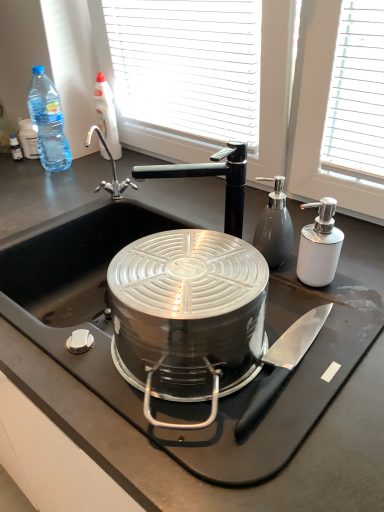
Question: From the image's perspective, is satin silver pump dispenser at right, positioned as the 1th bottle in right-to-left order, positioned above or below white glossy soap dispenser at right?

Choices:
 (A) above
 (B) below

Answer: (A)

Question: Is point (274, 259) positioned closer to the camera than point (324, 261)?

Choices:
 (A) farther
 (B) closer

Answer: (A)

Question: Which of these objects is positioned farthest from the blue plastic bottle at upper left, the first bottle in the left-to-right sequence?

Choices:
 (A) black matte faucet at upper center
 (B) white glossy soap dispenser at right
 (C) satin silver pump dispenser at right, positioned as the 1th bottle in right-to-left order
 (D) clear plastic bottle at upper left, which appears as the 2th bottle when viewed from the left
 (E) polished stainless steel knife at lower center

Answer: (E)

Question: Estimate the real-world distances between objects in this image. Which object is farther from the black matte countertop at center?

Choices:
 (A) blue plastic bottle at upper left, which appears as the 2th bottle when viewed from the front
 (B) white glossy soap dispenser at right
 (C) black matte faucet at upper center
 (D) polished stainless steel knife at lower center
 (E) clear plastic bottle at upper left, which ranks as the second bottle in right-to-left order

Answer: (E)